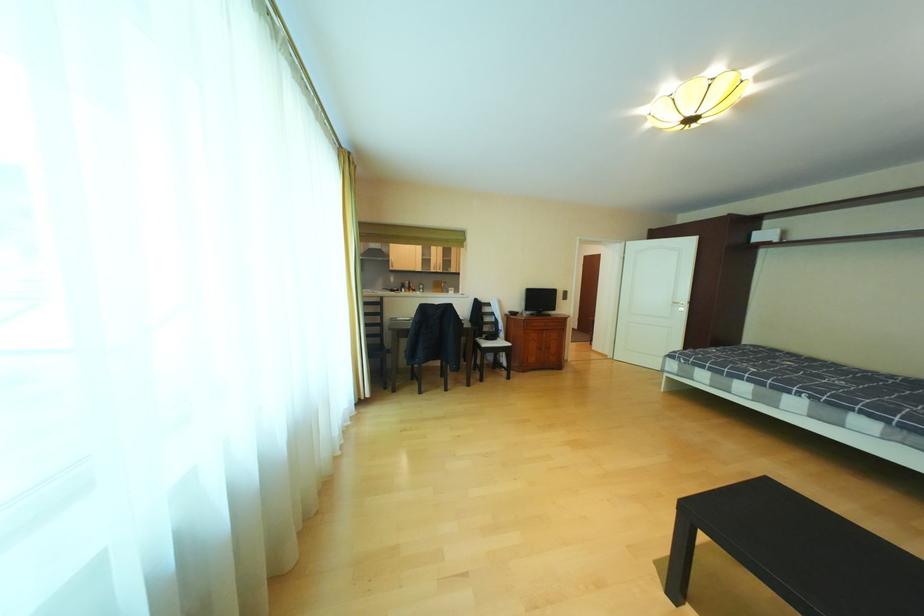
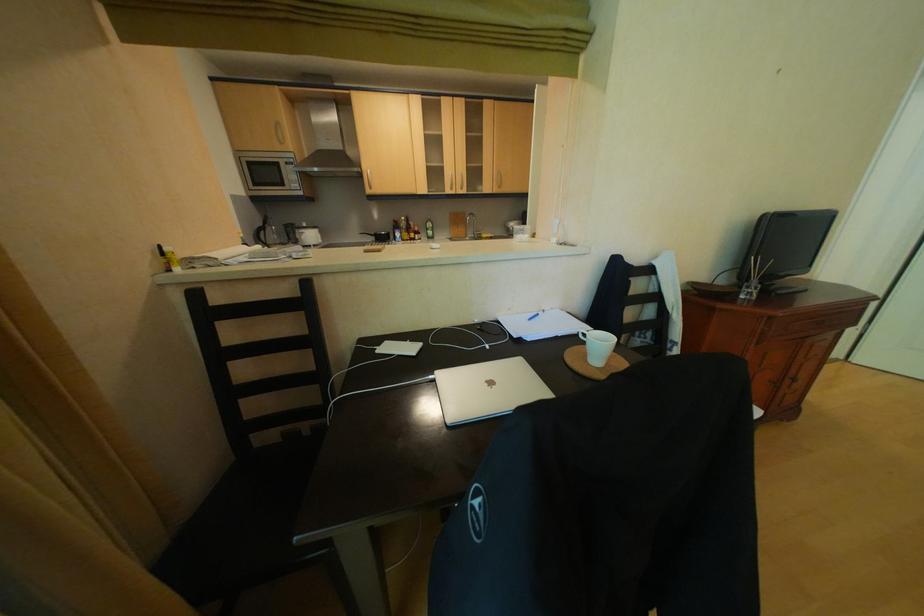
Find the pixel in the second image that matches [438,262] in the first image.

(446, 174)